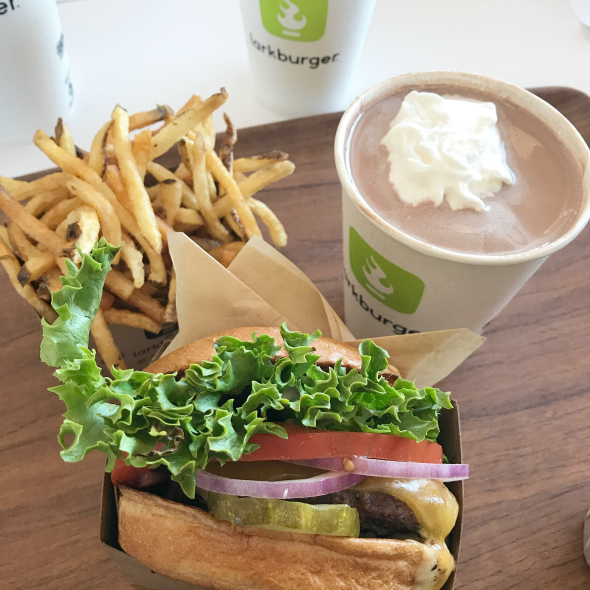
Identify the location of white table. The width and height of the screenshot is (590, 590). (155, 52).